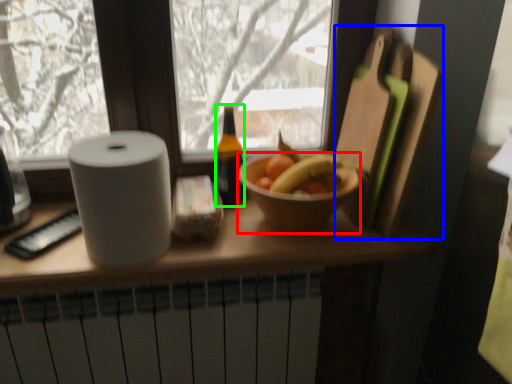
Question: Based on their relative distances, which object is farther from bowl (highlighted by a red box)? Choose from cutting board (highlighted by a blue box) and bottle (highlighted by a green box).

Choices:
 (A) cutting board
 (B) bottle

Answer: (B)